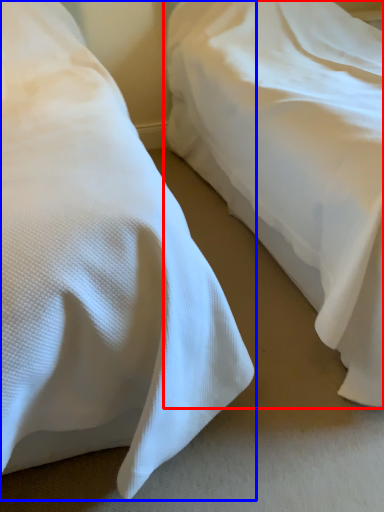
Question: Which point is further to the camera, bed (highlighted by a red box) or bed (highlighted by a blue box)?

Choices:
 (A) bed
 (B) bed

Answer: (A)